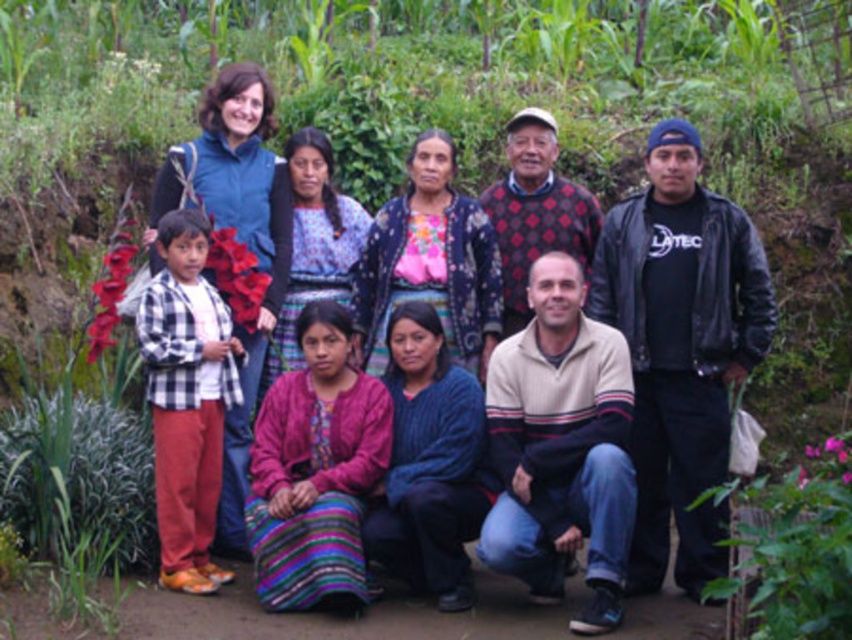
Question: Can you confirm if multicolored woven skirt at center is bigger than knitted sweater at center?

Choices:
 (A) yes
 (B) no

Answer: (A)

Question: Which object is the farthest from the multicolored woven skirt at center?

Choices:
 (A) black leather jacket at right
 (B) knitted sweater at center

Answer: (A)

Question: Considering the real-world distances, which object is farthest from the multicolored woven skirt at center?

Choices:
 (A) knitted sweater at center
 (B) black leather jacket at right

Answer: (B)

Question: Can you confirm if multicolored woven skirt at center is positioned to the right of knitted sweater at center?

Choices:
 (A) no
 (B) yes

Answer: (A)

Question: Which point is farther to the camera?

Choices:
 (A) (516, 179)
 (B) (370, 364)
 (C) (728, 337)

Answer: (A)

Question: Can you confirm if multicolored woven skirt at center is positioned above black leather jacket at right?

Choices:
 (A) no
 (B) yes

Answer: (B)